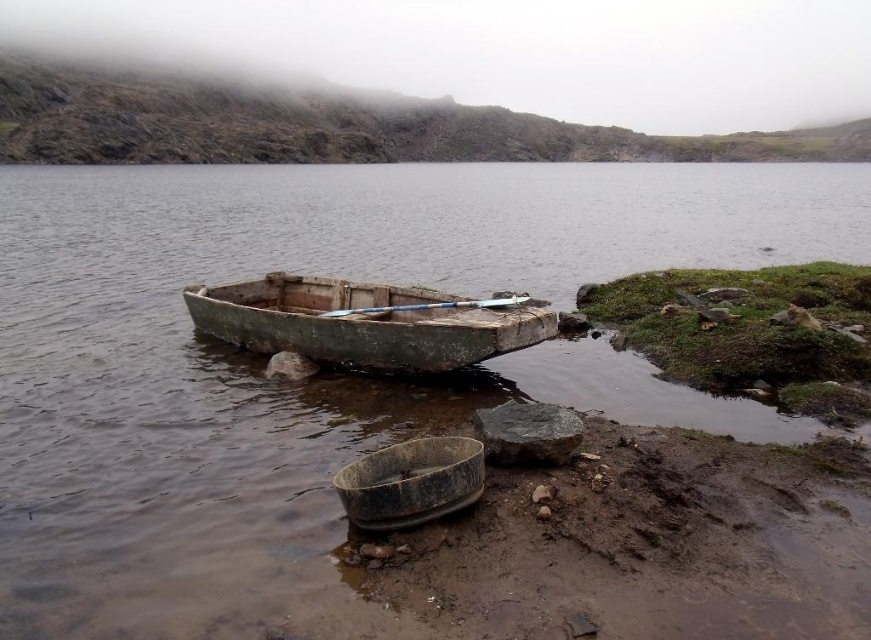
Question: Does brown matte water at center appear over muddy wet soil at lower right?

Choices:
 (A) yes
 (B) no

Answer: (A)

Question: Is muddy wet soil at lower right closer to camera compared to rusty metal boat at center?

Choices:
 (A) no
 (B) yes

Answer: (B)

Question: Which point is farther to the camera?

Choices:
 (A) (34, 538)
 (B) (254, 301)
 (C) (402, 496)
 (D) (575, 566)

Answer: (B)

Question: Among these objects, which one is nearest to the camera?

Choices:
 (A) rusty metal basin at lower center
 (B) brown matte water at center

Answer: (B)

Question: Can you confirm if muddy wet soil at lower right is smaller than rusty metal basin at lower center?

Choices:
 (A) no
 (B) yes

Answer: (A)

Question: Which point appears farthest from the camera in this image?

Choices:
 (A) (453, 467)
 (B) (350, 285)

Answer: (B)